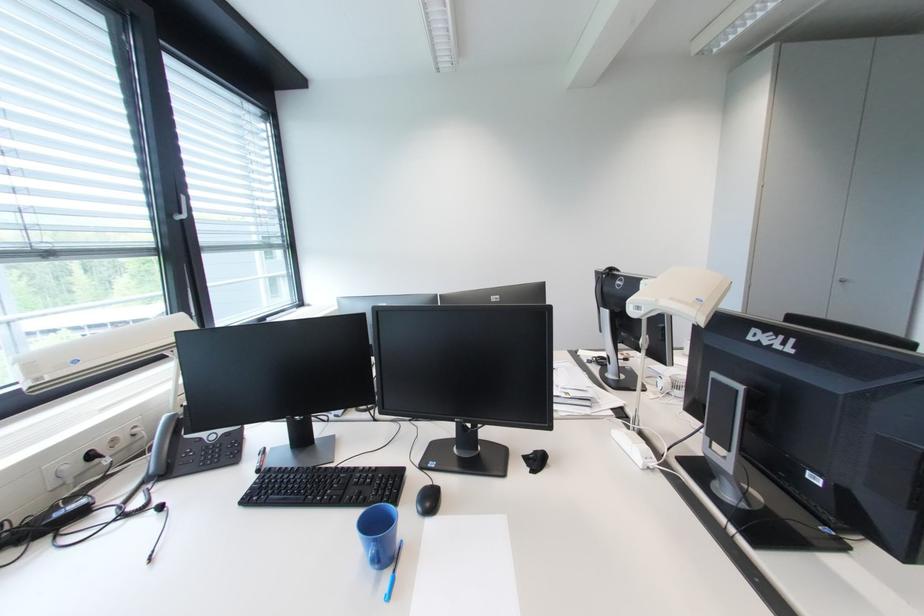
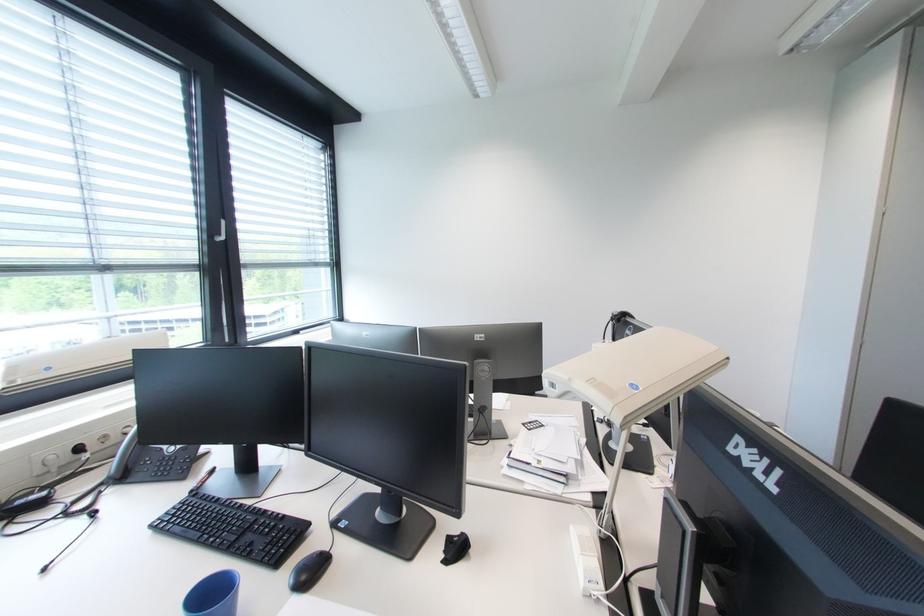
Find the pixel in the second image that matches (x=434, y=506) in the first image.

(310, 578)